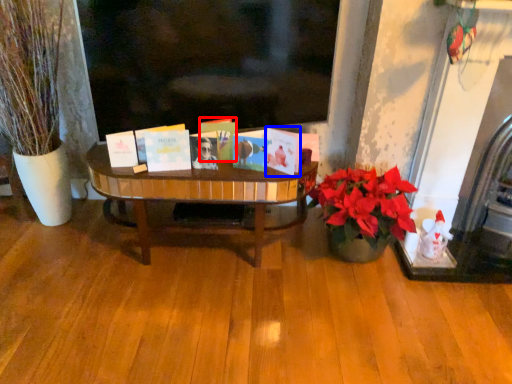
Question: Which object appears closest to the camera in this image, book (highlighted by a red box) or book (highlighted by a blue box)?

Choices:
 (A) book
 (B) book

Answer: (B)